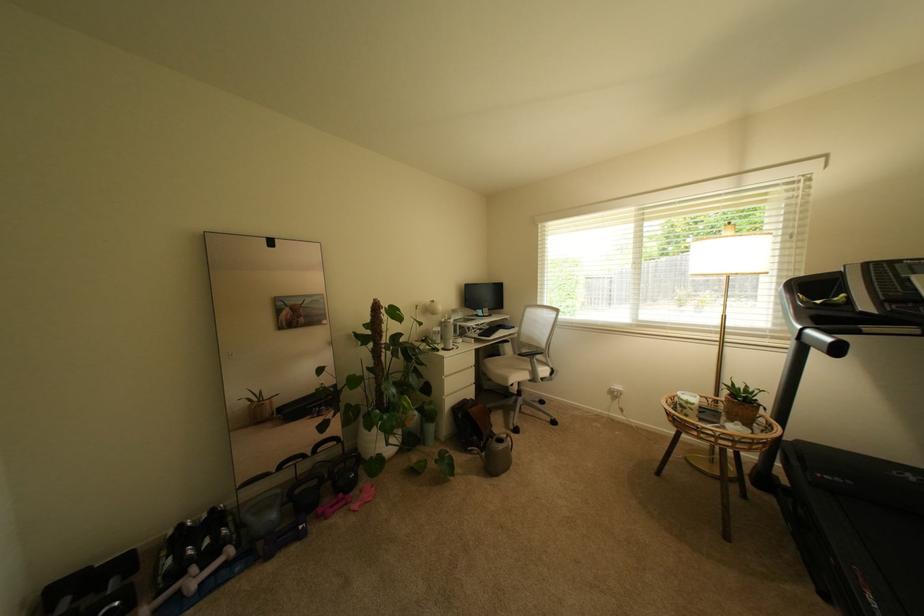
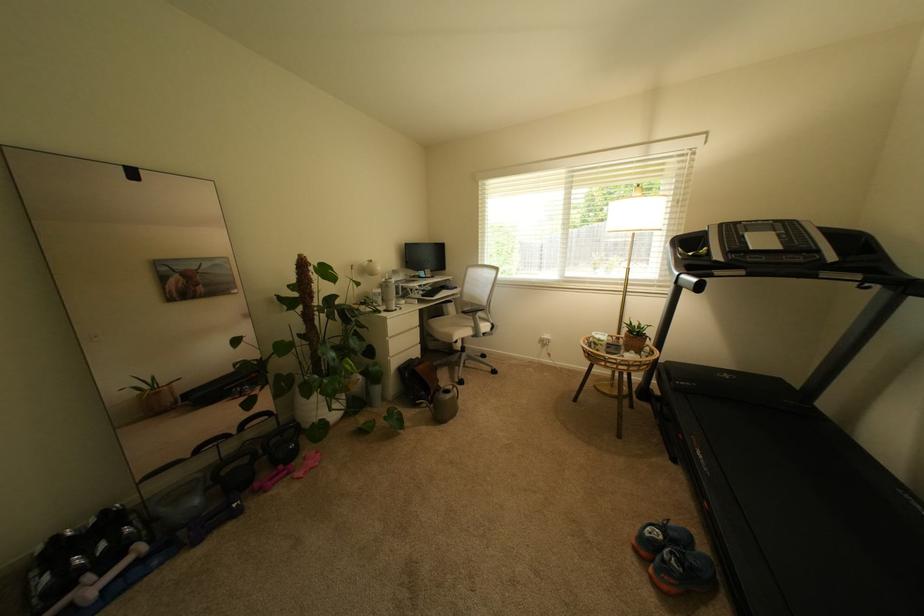
Locate, in the second image, the point that corresponds to (x=452, y=379) in the first image.

(395, 339)